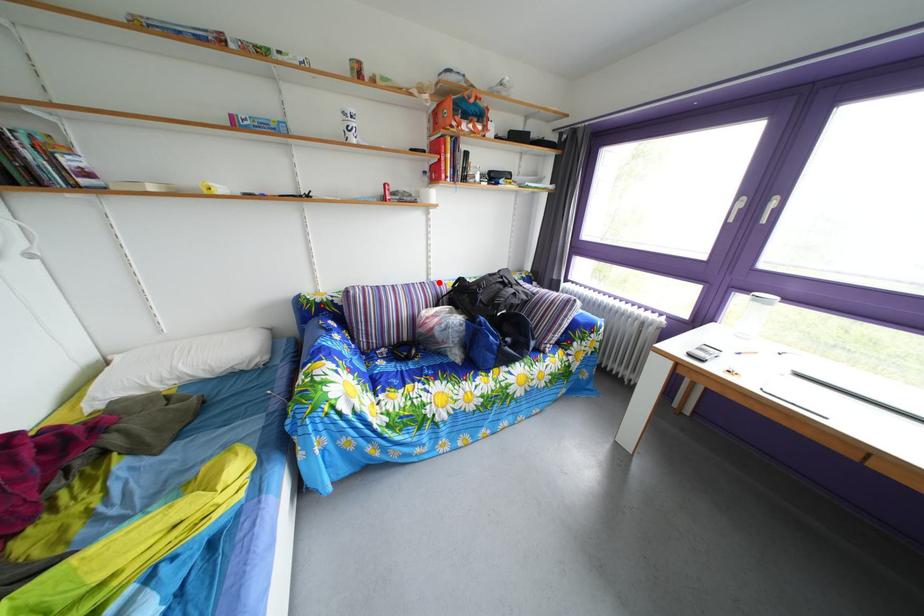
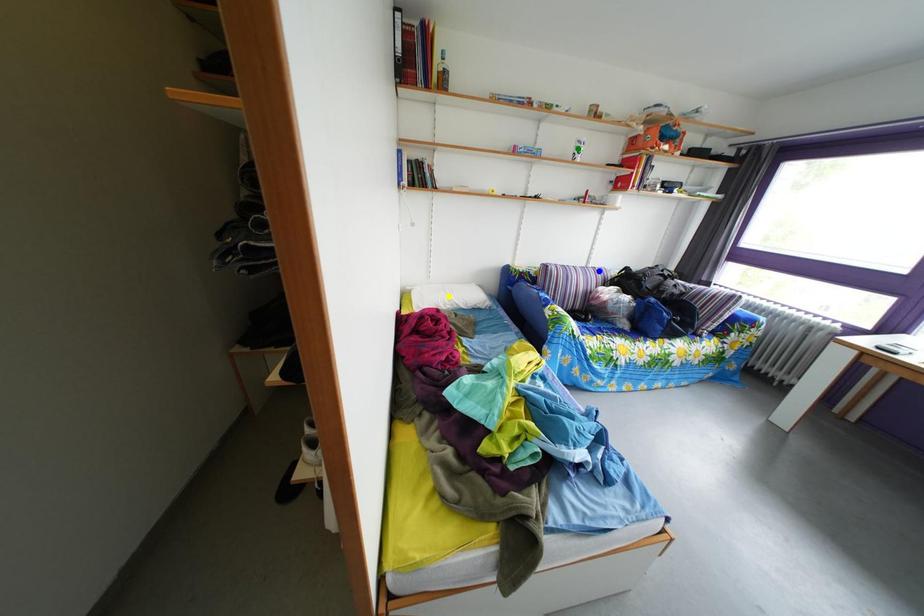
Question: I am providing you with two images of the same scene from different viewpoints. A red point is marked on the first image. You are given multiple points on the second image. Which mark in image 2 goes with the point in image 1?

Choices:
 (A) blue point
 (B) yellow point
 (C) green point

Answer: (A)